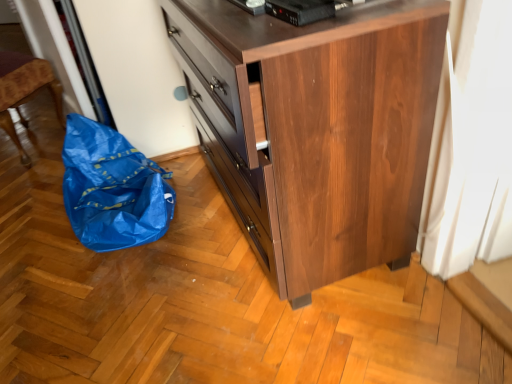
Question: Based on their sizes in the image, would you say blue plastic bag at left is bigger or smaller than brown wood chest of drawers at center?

Choices:
 (A) big
 (B) small

Answer: (B)

Question: Is blue plastic bag at left wider or thinner than brown wood chest of drawers at center?

Choices:
 (A) thin
 (B) wide

Answer: (A)

Question: Which object is the closest to the brown wood chest of drawers at center?

Choices:
 (A) black plastic device at upper center
 (B) blue plastic bag at left

Answer: (A)

Question: Which object is the closest to the black plastic device at upper center?

Choices:
 (A) brown wood chest of drawers at center
 (B) blue plastic bag at left

Answer: (A)